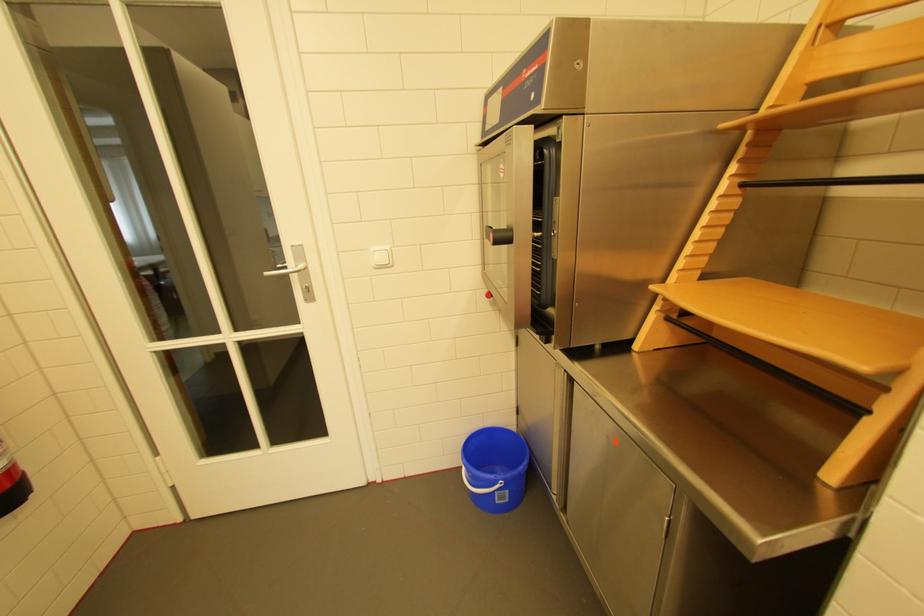
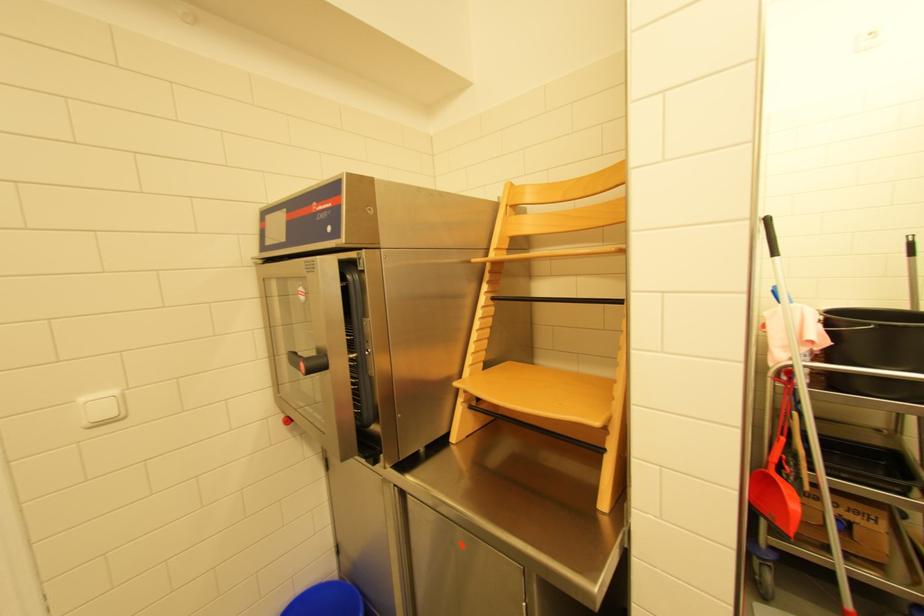
Where in the second image is the point corresponding to point 492,428 from the first image?

(304, 597)